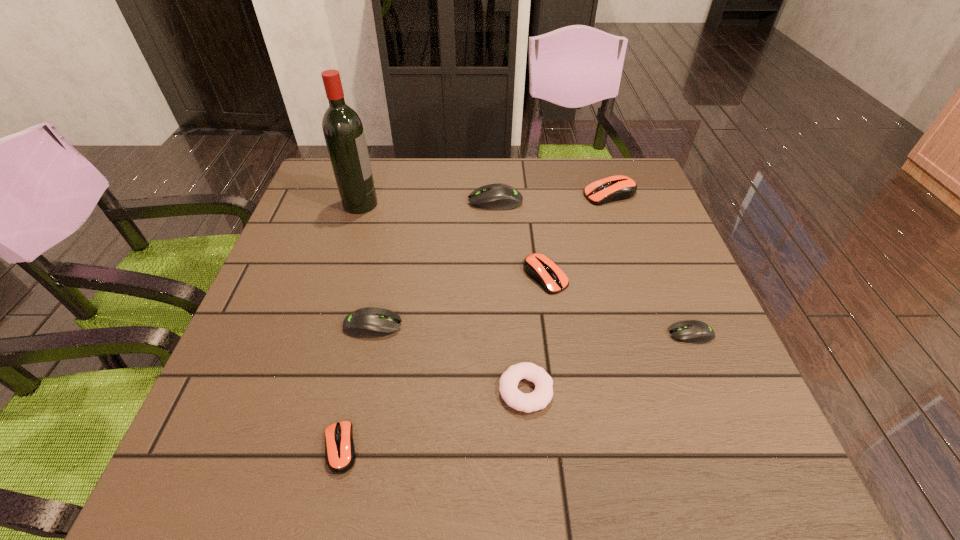
At what (x,y) coordinates should I click in order to perform the action: click on the tallest object. Please return your answer as a coordinate pair (x, y). Image resolution: width=960 pixels, height=540 pixels. Looking at the image, I should click on (343, 131).

Find the location of a particular element. The image size is (960, 540). red wine bottle is located at coordinates (343, 131).

The width and height of the screenshot is (960, 540). Identify the location of the second gray computer mouse from left to right. (498, 196).

Locate an element on the screen. The image size is (960, 540). the biggest gray computer mouse is located at coordinates (498, 196).

Where is `the farthest orange computer mouse`? the farthest orange computer mouse is located at coordinates (615, 188).

Image resolution: width=960 pixels, height=540 pixels. What are the coordinates of `the rightmost orange computer mouse` in the screenshot? It's located at click(x=615, y=188).

Where is `the second smallest gray computer mouse`? The image size is (960, 540). the second smallest gray computer mouse is located at coordinates (370, 322).

Find the location of a particular element. the second biggest orange computer mouse is located at coordinates (542, 269).

Image resolution: width=960 pixels, height=540 pixels. I want to click on the second farthest orange computer mouse, so click(x=542, y=269).

You are a GUI agent. You are given a task and a screenshot of the screen. Output one action in this format:
    pyautogui.click(x=<x>, y=<y>)
    Task: Click on the rightmost gray computer mouse
    This screenshot has width=960, height=540.
    Given the screenshot: What is the action you would take?
    pyautogui.click(x=690, y=331)